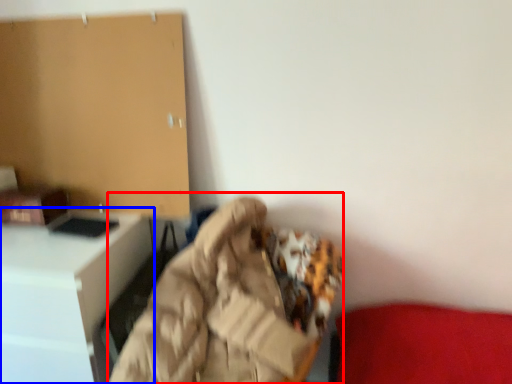
Question: Which point is further to the camera, bean bag chair (highlighted by a red box) or furniture (highlighted by a blue box)?

Choices:
 (A) bean bag chair
 (B) furniture

Answer: (B)